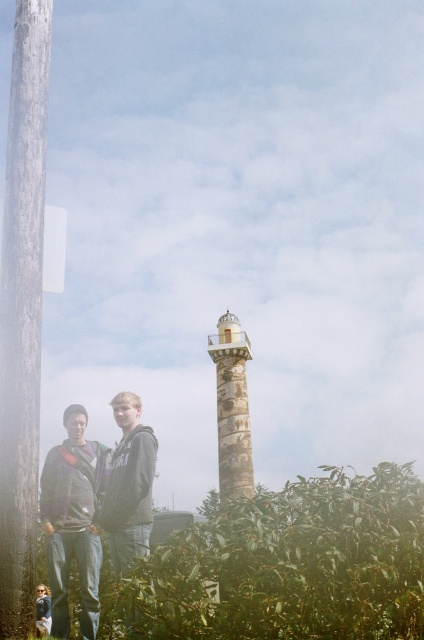
Is green leafy bush at lower center above stonework/light house at center?

Incorrect, green leafy bush at lower center is not positioned above stonework/light house at center.

The width and height of the screenshot is (424, 640). Identify the location of green leafy bush at lower center. [x=289, y=564].

This screenshot has width=424, height=640. What do you see at coordinates (128, 484) in the screenshot?
I see `dark gray hoodie at center` at bounding box center [128, 484].

Who is positioned more to the left, dark gray hoodie at center or stonework/light house at center?

dark gray hoodie at center is more to the left.

Identify the location of dark gray hoodie at center. Image resolution: width=424 pixels, height=640 pixels. (128, 484).

Which of these two, green leafy bush at lower center or matte gray hoodie at lower left, stands shorter?

Standing shorter between the two is matte gray hoodie at lower left.

Based on the photo, does green leafy bush at lower center have a larger size compared to matte gray hoodie at lower left?

Yes, green leafy bush at lower center is bigger than matte gray hoodie at lower left.

The width and height of the screenshot is (424, 640). What do you see at coordinates (289, 564) in the screenshot? I see `green leafy bush at lower center` at bounding box center [289, 564].

You are a GUI agent. You are given a task and a screenshot of the screen. Output one action in this format:
    pyautogui.click(x=<x>, y=<y>)
    Task: Click on the green leafy bush at lower center
    The width and height of the screenshot is (424, 640).
    Given the screenshot: What is the action you would take?
    pyautogui.click(x=289, y=564)